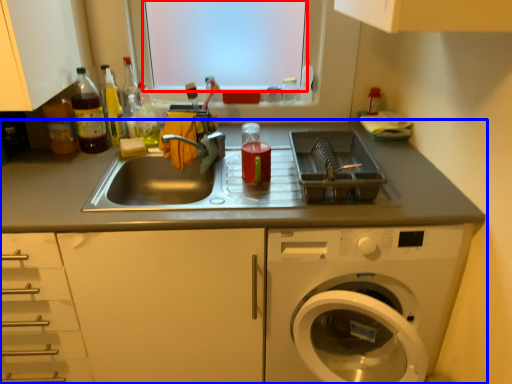
Question: Which point is further to the camera, window screen (highlighted by a red box) or countertop (highlighted by a blue box)?

Choices:
 (A) window screen
 (B) countertop

Answer: (A)